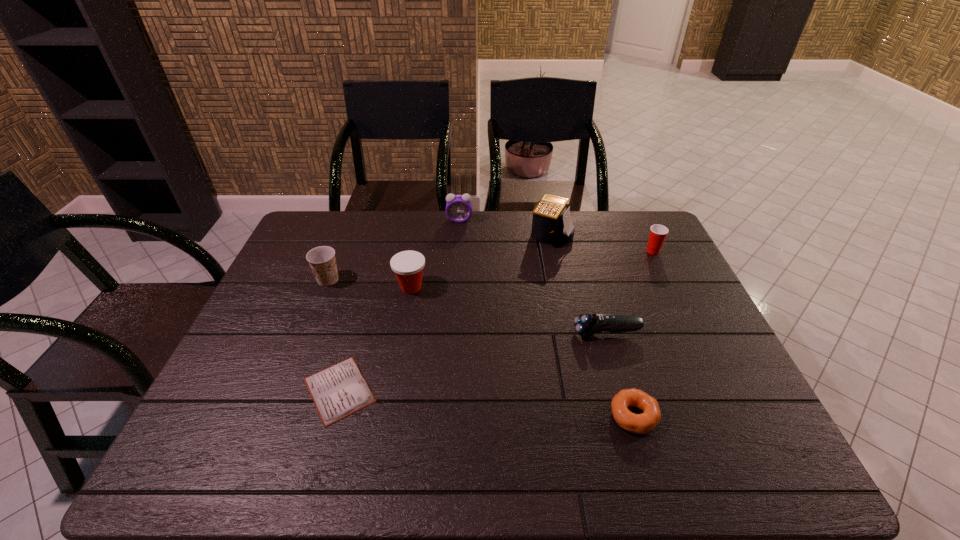
You are a GUI agent. You are given a task and a screenshot of the screen. Output one action in this format:
    pyautogui.click(x=<x>, y=<y>)
    Task: Click on the vacant space positioned 0.340m on the left of the calculator
    
    Given the screenshot: What is the action you would take?
    pyautogui.click(x=429, y=234)

Image resolution: width=960 pixels, height=540 pixels. I want to click on free location located on the face of the alarm clock, so click(x=455, y=294).

The height and width of the screenshot is (540, 960). I want to click on free region located 0.300m on the right of the second Dixie cup from right to left, so click(x=528, y=287).

You are a GUI agent. You are given a task and a screenshot of the screen. Output one action in this format:
    pyautogui.click(x=<x>, y=<y>)
    Task: Click on the vacant region located 0.220m on the back of the leftmost Dixie cup
    
    Given the screenshot: What is the action you would take?
    pyautogui.click(x=348, y=231)

This screenshot has width=960, height=540. I want to click on free location located on the front of the rightmost object, so click(x=689, y=327).

Where is `vacant space situated 0.270m on the head of the sixth farthest object`? The width and height of the screenshot is (960, 540). vacant space situated 0.270m on the head of the sixth farthest object is located at coordinates tap(472, 333).

Locate an element on the screen. vacant region located 0.160m on the head of the sixth farthest object is located at coordinates (514, 333).

Locate an element on the screen. This screenshot has width=960, height=540. free space located on the head of the sixth farthest object is located at coordinates (528, 333).

Identify the location of free space located 0.160m on the left of the seventh tallest object. This screenshot has height=540, width=960. (539, 416).

Find the location of `free region located on the left of the diary`. free region located on the left of the diary is located at coordinates (228, 390).